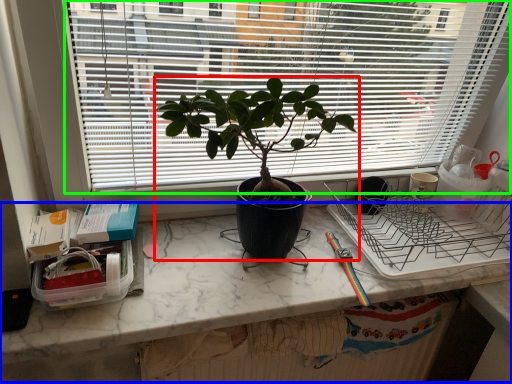
Question: Which is farther away from houseplant (highlighted by a red box)? computer desk (highlighted by a blue box) or window (highlighted by a green box)?

Choices:
 (A) computer desk
 (B) window

Answer: (A)